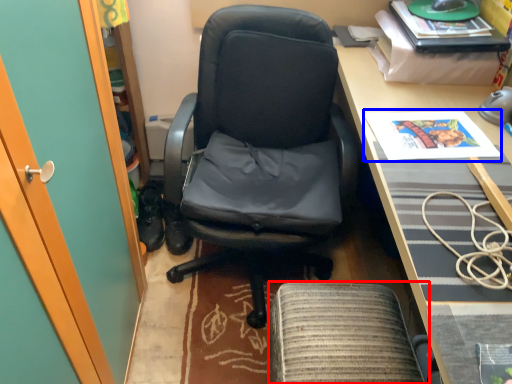
Question: Which object appears farthest to the camera in this image, footrest (highlighted by a red box) or magazine (highlighted by a blue box)?

Choices:
 (A) footrest
 (B) magazine

Answer: (B)